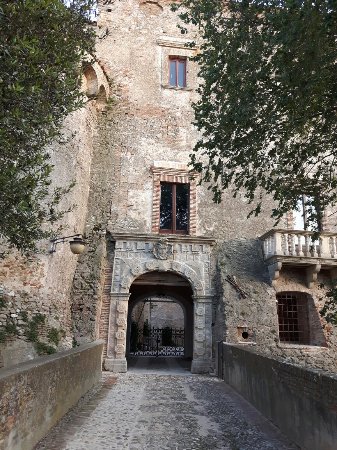
In order to click on window in this screenshot , I will do `click(171, 216)`, `click(179, 212)`.